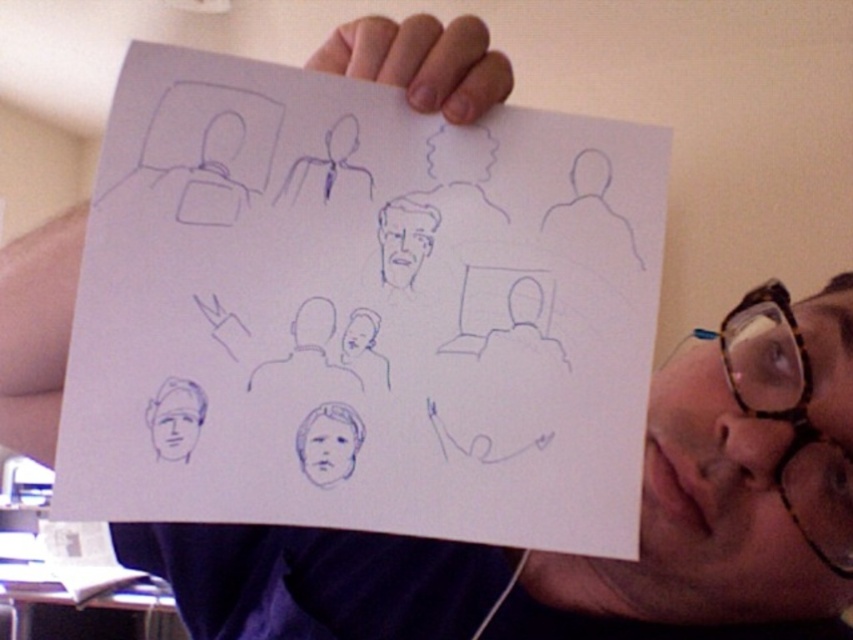
Question: Which object is closer to the camera taking this photo?

Choices:
 (A) smooth blue face at center
 (B) blue sketchy head at lower left
 (C) transparent tortoiseshell glasses at upper right
 (D) blue pencil drawing at center

Answer: (D)

Question: Does blue line drawing face at center appear on the right side of smooth blue face at center?

Choices:
 (A) yes
 (B) no

Answer: (A)

Question: Is blue line drawing face at center wider than smooth blue face at center?

Choices:
 (A) yes
 (B) no

Answer: (A)

Question: Does blue pencil drawing at center appear over blue line drawing face at center?

Choices:
 (A) yes
 (B) no

Answer: (B)

Question: Which of these objects is positioned farthest from the blue sketchy head at lower left?

Choices:
 (A) smooth blue face at center
 (B) blue pencil drawing at center

Answer: (B)

Question: Which of these objects is positioned closest to the blue pencil drawing at center?

Choices:
 (A) blue line drawing face at center
 (B) blue sketchy head at lower left

Answer: (A)